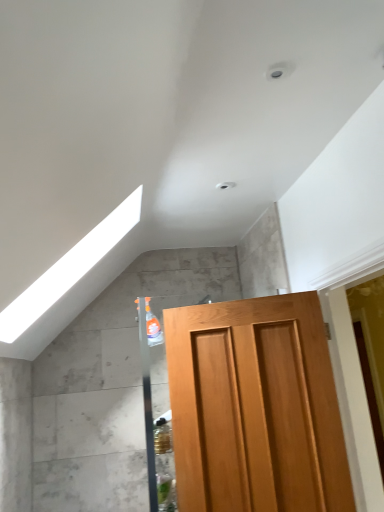
Question: In the image, is light brown wooden door at center positioned in front of or behind white glossy exhaust hood at upper left?

Choices:
 (A) front
 (B) behind

Answer: (B)

Question: Considering the positions of light brown wooden door at center and white glossy exhaust hood at upper left in the image, is light brown wooden door at center wider or thinner than white glossy exhaust hood at upper left?

Choices:
 (A) thin
 (B) wide

Answer: (A)

Question: Based on their sizes in the image, would you say light brown wooden door at center is bigger or smaller than white glossy exhaust hood at upper left?

Choices:
 (A) big
 (B) small

Answer: (B)

Question: Choose the correct answer: Is white glossy exhaust hood at upper left inside light brown wooden door at center or outside it?

Choices:
 (A) outside
 (B) inside

Answer: (A)

Question: From a real-world perspective, is white glossy exhaust hood at upper left physically located above or below light brown wooden door at center?

Choices:
 (A) above
 (B) below

Answer: (A)

Question: Considering the positions of white glossy exhaust hood at upper left and light brown wooden door at center in the image, is white glossy exhaust hood at upper left taller or shorter than light brown wooden door at center?

Choices:
 (A) tall
 (B) short

Answer: (B)

Question: Looking at the image, does white glossy exhaust hood at upper left seem bigger or smaller compared to light brown wooden door at center?

Choices:
 (A) big
 (B) small

Answer: (A)